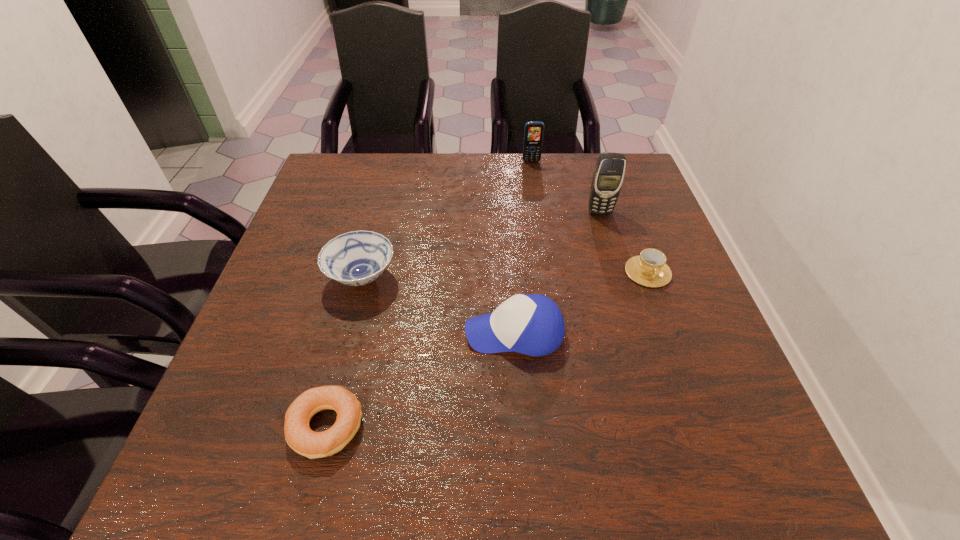
You are a GUI agent. You are given a task and a screenshot of the screen. Output one action in this format:
    pyautogui.click(x=<x>, y=<y>)
    Task: Click on the unoccupied area between the shorter cellular telephone and the cup
    The width and height of the screenshot is (960, 540).
    Given the screenshot: What is the action you would take?
    pyautogui.click(x=589, y=217)

Find the location of `blank region between the soup bowl and the nearer cellular telephone`. blank region between the soup bowl and the nearer cellular telephone is located at coordinates (481, 245).

Identify the location of free space between the shorter cellular telephone and the cup. This screenshot has width=960, height=540. click(x=589, y=217).

At what (x,y) coordinates should I click in order to perform the action: click on free point between the baseball cap and the second farthest object. Please return your answer as a coordinate pair (x, y). Looking at the image, I should click on (557, 272).

Locate an element on the screen. This screenshot has height=540, width=960. unoccupied position between the farthest object and the nearest object is located at coordinates (429, 294).

This screenshot has height=540, width=960. I want to click on empty location between the second farthest object and the shorter cellular telephone, so 565,187.

Identify the location of blank region between the nearest object and the fourth tallest object. The width and height of the screenshot is (960, 540). (344, 352).

Where is `free spot between the cup and the left cellular telephone`? free spot between the cup and the left cellular telephone is located at coordinates (589, 217).

I want to click on blank region between the baseball cap and the farther cellular telephone, so click(523, 247).

Identify the location of object that is the third closest to the cup. The height and width of the screenshot is (540, 960). (533, 133).